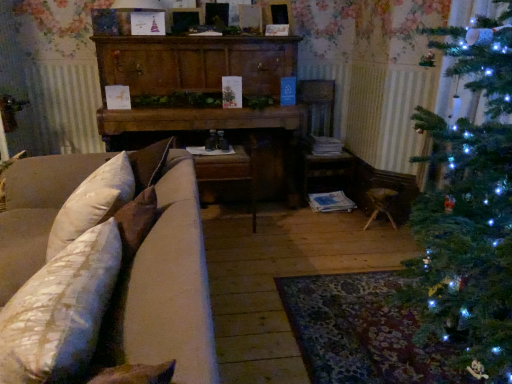
Question: From a real-world perspective, is wooden dresser at center physically located above or below wooden armchair at center?

Choices:
 (A) below
 (B) above

Answer: (B)

Question: Is wooden dresser at center in front of or behind wooden armchair at center in the image?

Choices:
 (A) behind
 (B) front

Answer: (B)

Question: Estimate the real-world distances between objects in this image. Which object is farther from the wooden armchair at center?

Choices:
 (A) beige fabric couch at left
 (B) wooden dresser at center
 (C) white textured pillow at lower left

Answer: (C)

Question: Based on their relative distances, which object is farther from the wooden armchair at center?

Choices:
 (A) wooden dresser at center
 (B) beige fabric couch at left
 (C) white textured pillow at lower left

Answer: (C)